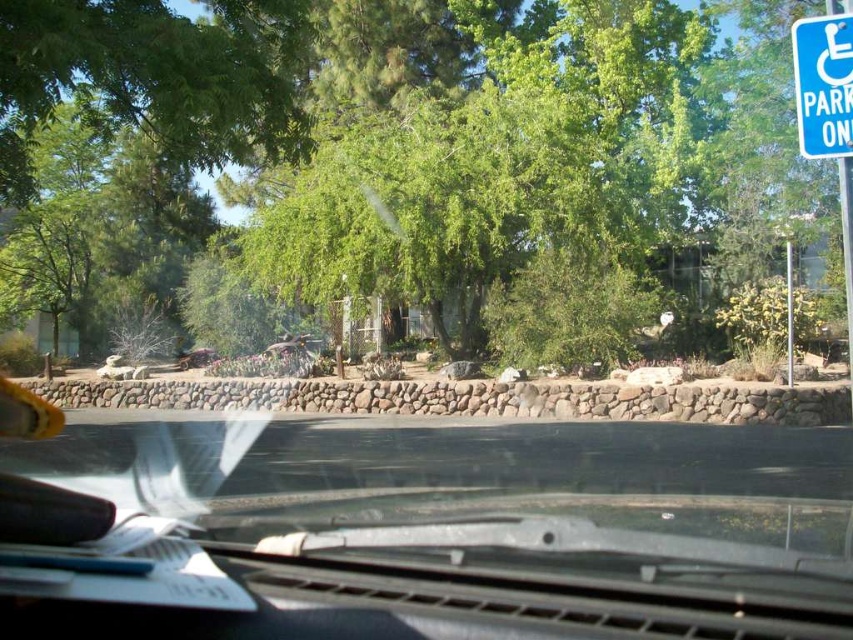
Question: Among these points, which one is nearest to the camera?

Choices:
 (A) (142, 481)
 (B) (654, 204)

Answer: (A)

Question: Is transparent glass windshield at center thinner than blue plastic parking sign at upper right?

Choices:
 (A) no
 (B) yes

Answer: (A)

Question: Which of the following is the closest to the observer?

Choices:
 (A) (485, 547)
 (B) (817, 132)

Answer: (A)

Question: Does green leafy tree at center have a lesser width compared to transparent glass windshield at center?

Choices:
 (A) no
 (B) yes

Answer: (A)

Question: Does green leafy tree at center have a lesser width compared to blue plastic parking sign at upper right?

Choices:
 (A) no
 (B) yes

Answer: (A)

Question: Among these objects, which one is farthest from the camera?

Choices:
 (A) blue plastic parking sign at upper right
 (B) transparent glass windshield at center
 (C) green leafy tree at center

Answer: (C)